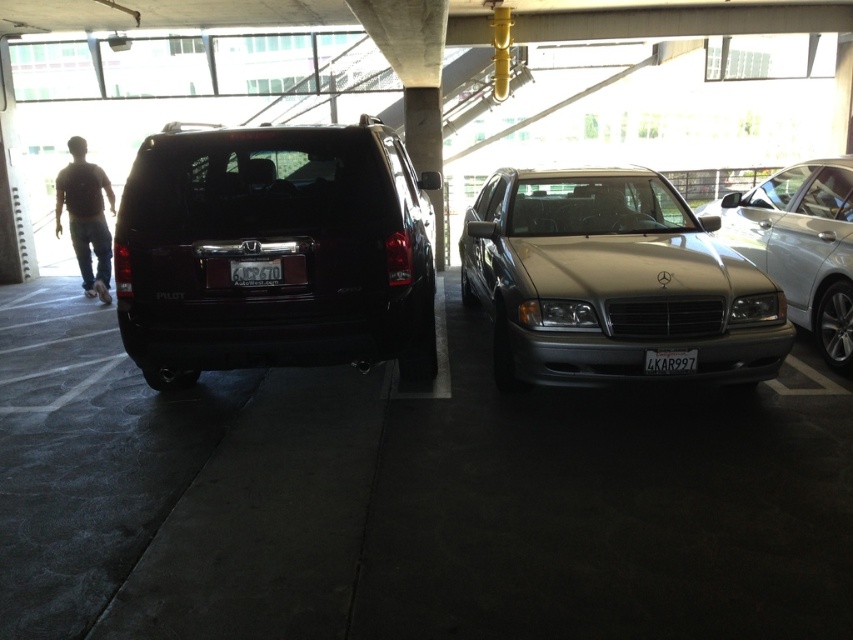
You are a delivery person trying to park your van between the black matte suv at center and the brown cotton shirt at left. Can your van, which is 2.2 meters wide, fit in the space between them?

The black matte suv at center might be wider than brown cotton shirt at left, so the space between them may not be wide enough for your van which requires 2.2 meters. Please check the actual width before attempting to park.

You are a delivery person with a 1.2 meter wide cart. You need to navigate between the black matte suv at center and the brown cotton shirt at left to deliver a package. Can your cart fit through the space between them?

The black matte suv at center and brown cotton shirt at left are 6.57 meters apart from each other, so the 1.2 meter wide cart can easily fit through the space between them.

You are standing at the entrance of the parking garage and see the black Honda Pilot SUV on the left and the silver Mercedes Benz sedan on the right. There is also a point marked at coordinates (x=405, y=500). Which vehicle is closest to this point?

The point at coordinates (x=405, y=500) corresponds to the black matte SUV at center, so it is closest to the black Honda Pilot SUV on the left.